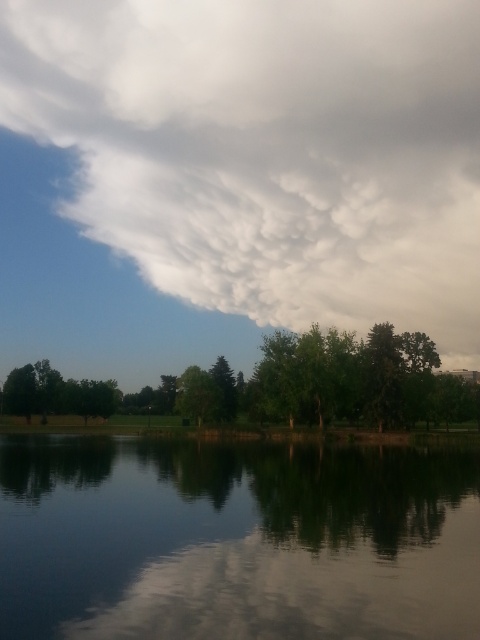
Does point (479, 593) lie in front of point (191, 417)?

Yes, it is.

From the picture: Between smooth reflective water at center and green leafy tree at center, which one appears on the right side from the viewer's perspective?

From the viewer's perspective, smooth reflective water at center appears more on the right side.

Where is `smooth reflective water at center`? Image resolution: width=480 pixels, height=640 pixels. smooth reflective water at center is located at coordinates point(236,540).

Is white fluffy cloud at upper center taller than green leafy tree at center?

Correct, white fluffy cloud at upper center is much taller as green leafy tree at center.

Based on the photo, can you confirm if white fluffy cloud at upper center is positioned below green leafy tree at center?

Incorrect, white fluffy cloud at upper center is not positioned below green leafy tree at center.

Locate an element on the screen. The image size is (480, 640). white fluffy cloud at upper center is located at coordinates [268, 150].

What are the coordinates of `white fluffy cloud at upper center` in the screenshot? It's located at (268, 150).

Can you confirm if white fluffy cloud at upper center is thinner than smooth reflective water at center?

In fact, white fluffy cloud at upper center might be wider than smooth reflective water at center.

Does point (288, 275) come farther from viewer compared to point (250, 518)?

That is True.

The height and width of the screenshot is (640, 480). In order to click on white fluffy cloud at upper center in this screenshot , I will do `click(268, 150)`.